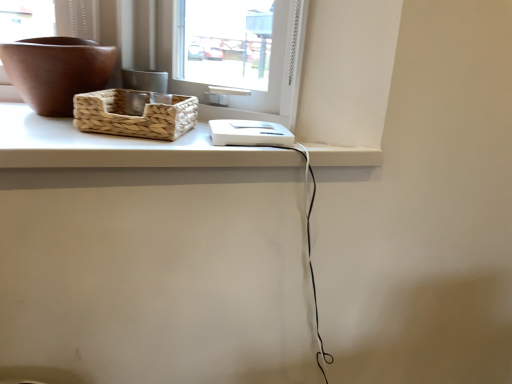
What do you see at coordinates (134, 115) in the screenshot? I see `woven natural picnic basket at upper left` at bounding box center [134, 115].

The width and height of the screenshot is (512, 384). Find the location of `brown matte bowl at upper left`. brown matte bowl at upper left is located at coordinates (57, 71).

The height and width of the screenshot is (384, 512). What are the coordinates of `picnic basket above the white matte counter top at upper center (from a real-world perspective)` in the screenshot? It's located at (134, 115).

What's the angular difference between woven natural picnic basket at upper left and white matte counter top at upper center's facing directions?

The angle between the facing direction of woven natural picnic basket at upper left and the facing direction of white matte counter top at upper center is 24.7 degrees.

From a real-world perspective, is woven natural picnic basket at upper left below white matte counter top at upper center?

No, from a real-world perspective, woven natural picnic basket at upper left is not beneath white matte counter top at upper center.

Is the position of woven natural picnic basket at upper left less distant than that of white matte counter top at upper center?

No, the depth of woven natural picnic basket at upper left is greater than that of white matte counter top at upper center.

Does woven natural picnic basket at upper left appear on the right side of brown matte bowl at upper left?

Yes.

Considering the positions of objects woven natural picnic basket at upper left and brown matte bowl at upper left in the image provided, who is in front, woven natural picnic basket at upper left or brown matte bowl at upper left?

woven natural picnic basket at upper left.

Is there a large distance between woven natural picnic basket at upper left and brown matte bowl at upper left?

Actually, woven natural picnic basket at upper left and brown matte bowl at upper left are a little close together.

Are white matte counter top at upper center and brown matte bowl at upper left far apart?

Actually, white matte counter top at upper center and brown matte bowl at upper left are a little close together.

How many degrees apart are the facing directions of white matte counter top at upper center and brown matte bowl at upper left?

The facing directions of white matte counter top at upper center and brown matte bowl at upper left are 24.7 degrees apart.

Which object is further away from the camera, white matte counter top at upper center or brown matte bowl at upper left?

brown matte bowl at upper left.

From a real-world perspective, who is located lower, white matte counter top at upper center or brown matte bowl at upper left?

In real-world perspective, white matte counter top at upper center is lower.

In the scene shown: From a real-world perspective, is white matte counter top at upper center on woven natural picnic basket at upper left?

No.

Considering the relative sizes of white matte counter top at upper center and woven natural picnic basket at upper left in the image provided, is white matte counter top at upper center taller than woven natural picnic basket at upper left?

No.

Looking at the image, does white matte counter top at upper center seem bigger or smaller compared to woven natural picnic basket at upper left?

white matte counter top at upper center is bigger than woven natural picnic basket at upper left.

Between brown matte bowl at upper left and white matte counter top at upper center, which one is positioned behind?

Positioned behind is brown matte bowl at upper left.

At what (x,y) coordinates should I click in order to perform the action: click on counter top in front of the brown matte bowl at upper left. Please return your answer as a coordinate pair (x, y). Looking at the image, I should click on (117, 147).

Could you tell me if brown matte bowl at upper left is facing white matte counter top at upper center?

No, brown matte bowl at upper left does not turn towards white matte counter top at upper center.

Which is more to the left, brown matte bowl at upper left or white matte counter top at upper center?

From the viewer's perspective, brown matte bowl at upper left appears more on the left side.

Is woven natural picnic basket at upper left at the back of brown matte bowl at upper left?

No.

Looking at the image, does brown matte bowl at upper left seem bigger or smaller compared to woven natural picnic basket at upper left?

Clearly, brown matte bowl at upper left is larger in size than woven natural picnic basket at upper left.

Would you say brown matte bowl at upper left is inside or outside woven natural picnic basket at upper left?

brown matte bowl at upper left is outside woven natural picnic basket at upper left.

The image size is (512, 384). I want to click on picnic basket located on the left of white matte counter top at upper center, so click(x=134, y=115).

I want to click on picnic basket below the brown matte bowl at upper left (from the image's perspective), so click(x=134, y=115).

Considering their positions, is woven natural picnic basket at upper left positioned further to white matte counter top at upper center than brown matte bowl at upper left?

brown matte bowl at upper left is positioned further to the anchor white matte counter top at upper center.

Considering their positions, is woven natural picnic basket at upper left positioned further to brown matte bowl at upper left than white matte counter top at upper center?

white matte counter top at upper center.

Looking at the image, which one is located closer to brown matte bowl at upper left, white matte counter top at upper center or woven natural picnic basket at upper left?

Among the two, woven natural picnic basket at upper left is located nearer to brown matte bowl at upper left.

Based on their spatial positions, is white matte counter top at upper center or brown matte bowl at upper left further from woven natural picnic basket at upper left?

Based on the image, brown matte bowl at upper left appears to be further to woven natural picnic basket at upper left.

When comparing their distances from woven natural picnic basket at upper left, does brown matte bowl at upper left or white matte counter top at upper center seem closer?

white matte counter top at upper center is closer to woven natural picnic basket at upper left.

From the image, which object appears to be farther from white matte counter top at upper center, brown matte bowl at upper left or woven natural picnic basket at upper left?

brown matte bowl at upper left.

The height and width of the screenshot is (384, 512). I want to click on picnic basket between brown matte bowl at upper left and white matte counter top at upper center in the horizontal direction, so click(x=134, y=115).